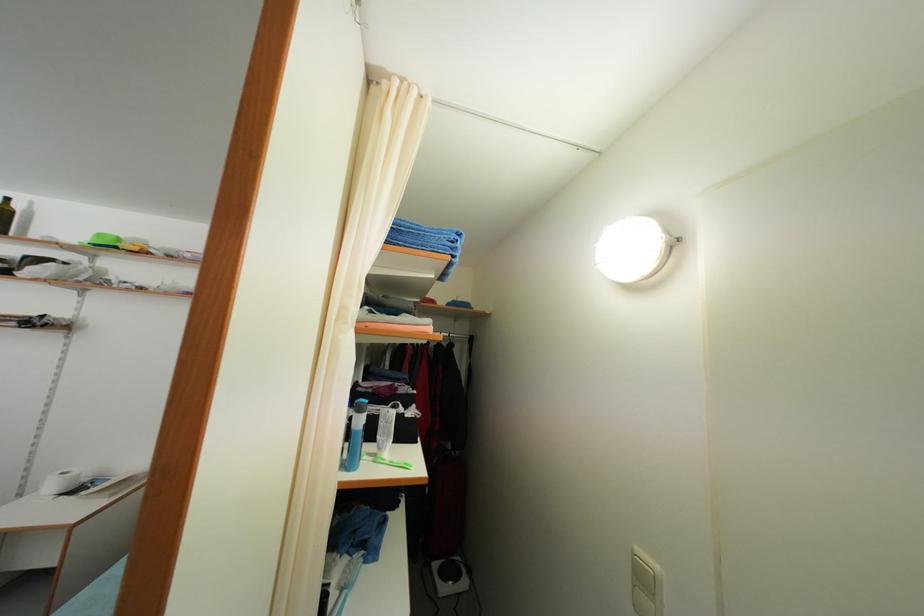
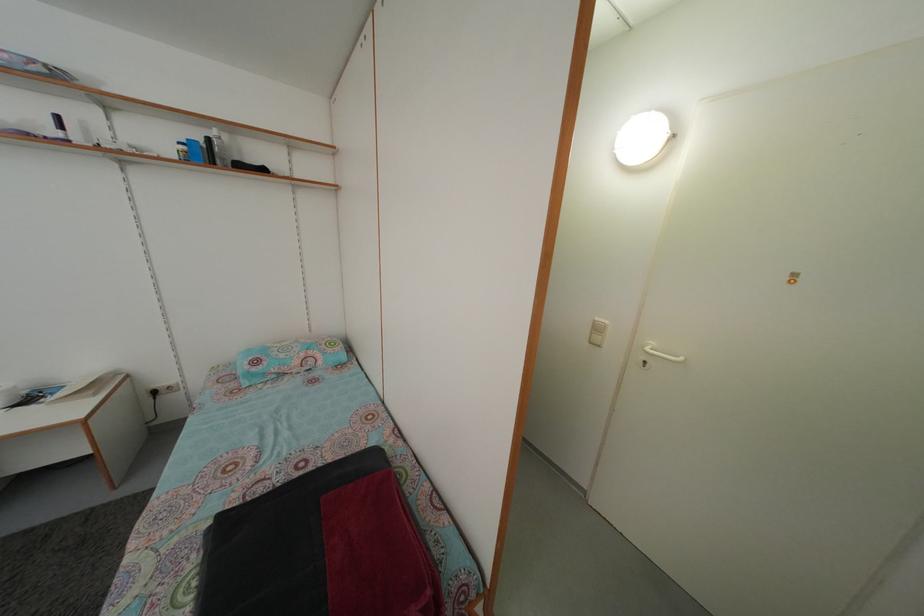
Where in the second image is the point corresponding to pixel 643 557 from the first image?

(602, 326)